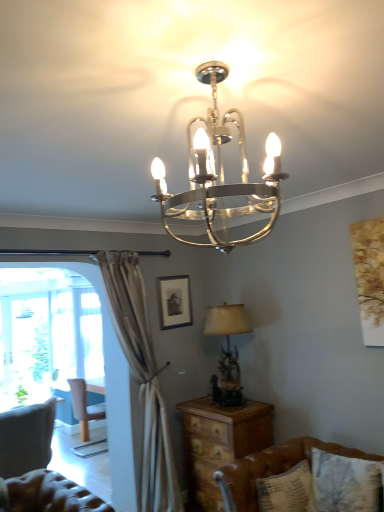
Question: Would you say light brown wooden chair at left is inside or outside patterned fabric pillow at lower right?

Choices:
 (A) outside
 (B) inside

Answer: (A)

Question: In terms of width, does light brown wooden chair at left look wider or thinner when compared to patterned fabric pillow at lower right?

Choices:
 (A) wide
 (B) thin

Answer: (A)

Question: Considering the real-world distances, which object is closest to the brown leather couch at lower right?

Choices:
 (A) patterned fabric pillow at lower right
 (B) matte beige lampshade at right, which is the 2th lamp from top to bottom
 (C) light brown wooden chair at left
 (D) matte black picture frame at center
 (E) tufted leather swivel chair at lower left

Answer: (A)

Question: Estimate the real-world distances between objects in this image. Which object is closer to the matte beige lampshade at right, the 2th lamp positioned from the front?

Choices:
 (A) polished metal chandelier at upper center, the 1th lamp from the top
 (B) matte black picture frame at center
 (C) patterned fabric pillow at lower right
 (D) wooden nightstand at lower center
 (E) tufted leather swivel chair at lower left

Answer: (D)